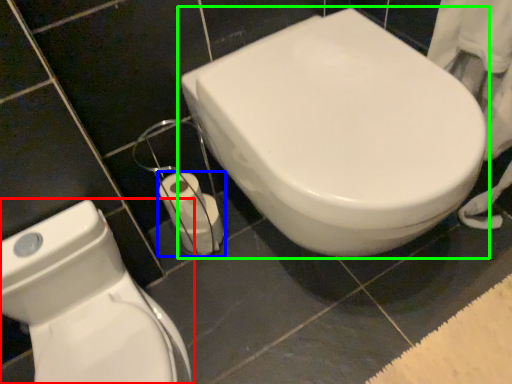
Question: Which object is positioned closest to toilet (highlighted by a red box)? Select from toilet paper (highlighted by a blue box) and toilet (highlighted by a green box).

Choices:
 (A) toilet paper
 (B) toilet

Answer: (A)